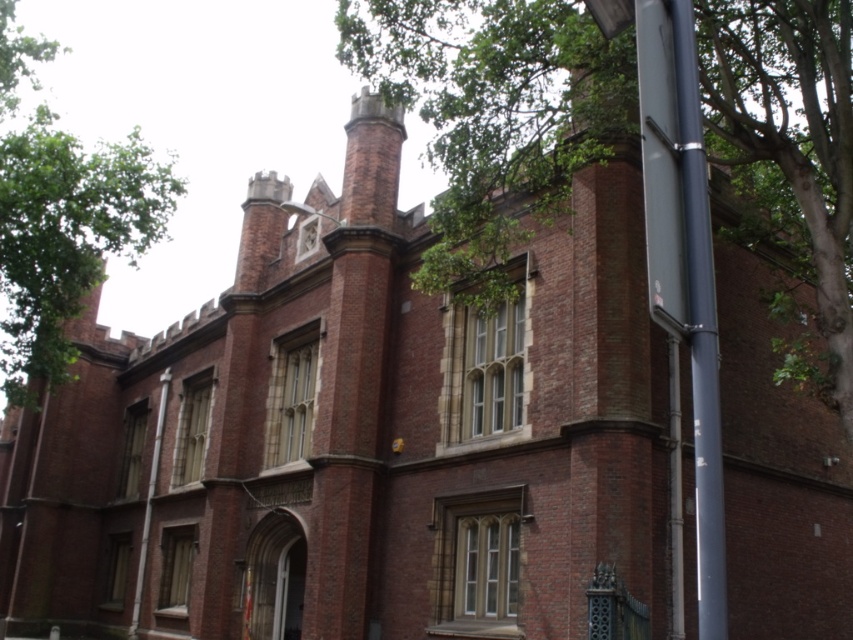
Question: Among these objects, which one is nearest to the camera?

Choices:
 (A) green leafy tree at upper left
 (B) smooth metallic pole at right
 (C) green leafy tree at upper right

Answer: (B)

Question: Which object is closer to the camera taking this photo?

Choices:
 (A) green leafy tree at upper left
 (B) green leafy tree at upper right
 (C) smooth metallic pole at right

Answer: (C)

Question: Is green leafy tree at upper right to the right of green leafy tree at upper left from the viewer's perspective?

Choices:
 (A) no
 (B) yes

Answer: (B)

Question: Is green leafy tree at upper left below smooth metallic pole at right?

Choices:
 (A) no
 (B) yes

Answer: (A)

Question: Is green leafy tree at upper left wider than smooth metallic pole at right?

Choices:
 (A) yes
 (B) no

Answer: (A)

Question: Which is farther from the green leafy tree at upper right?

Choices:
 (A) green leafy tree at upper left
 (B) smooth metallic pole at right

Answer: (A)